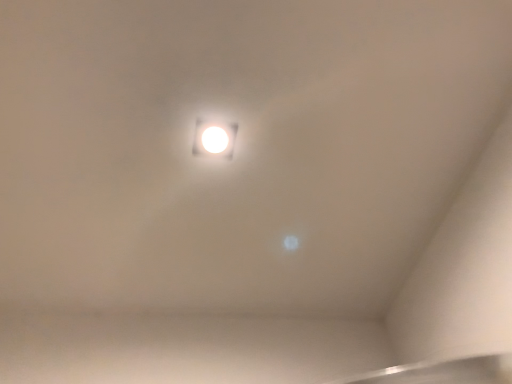
In order to face white glossy light at upper center, should I rotate leftwards or rightwards?

You should look left and rotate roughly 6.029 degrees.

Image resolution: width=512 pixels, height=384 pixels. What do you see at coordinates (214, 139) in the screenshot?
I see `white glossy light at upper center` at bounding box center [214, 139].

The height and width of the screenshot is (384, 512). In order to click on white glossy light at upper center in this screenshot , I will do click(214, 139).

The height and width of the screenshot is (384, 512). Find the location of `white glossy light at upper center`. white glossy light at upper center is located at coordinates (214, 139).